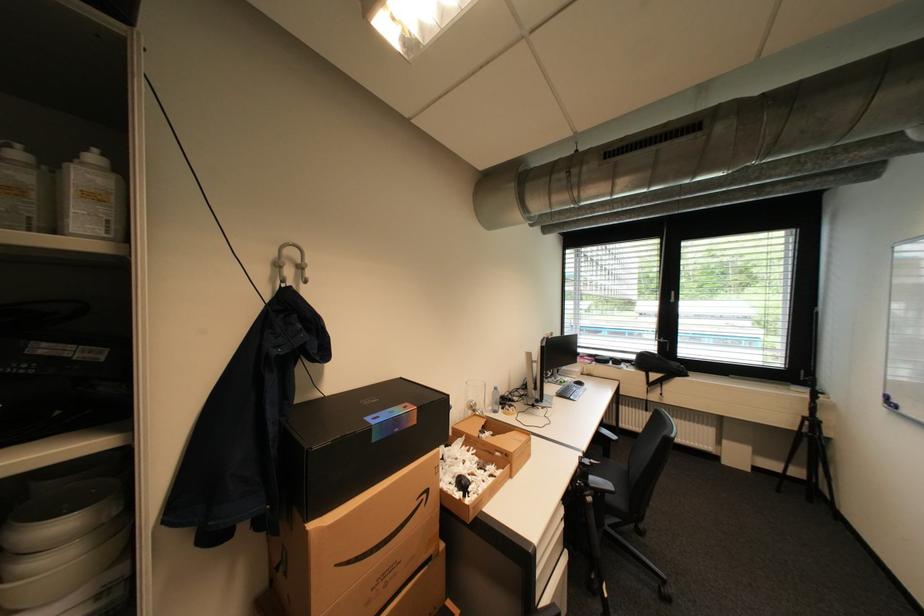
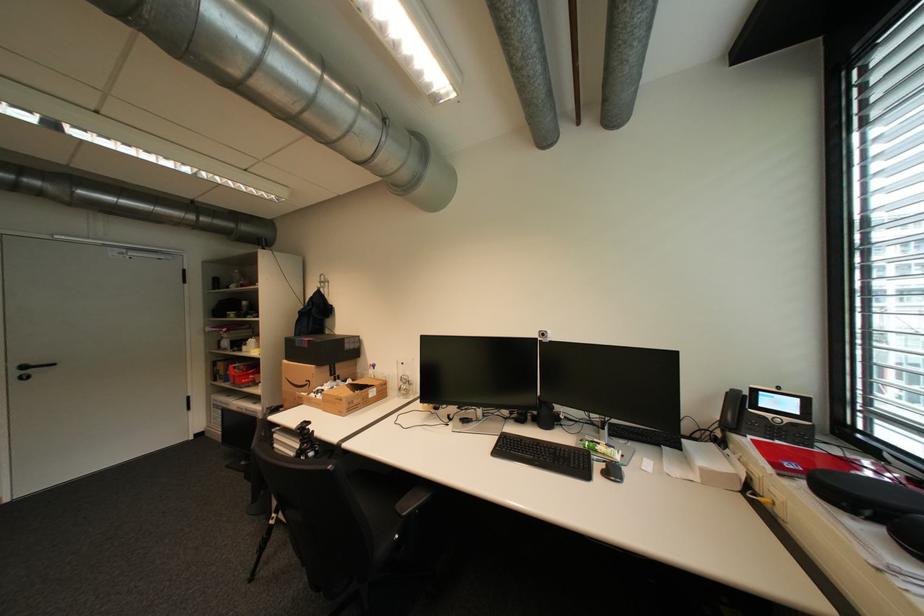
Find the pixel in the second image that matches [405,431] in the first image.

(310, 346)